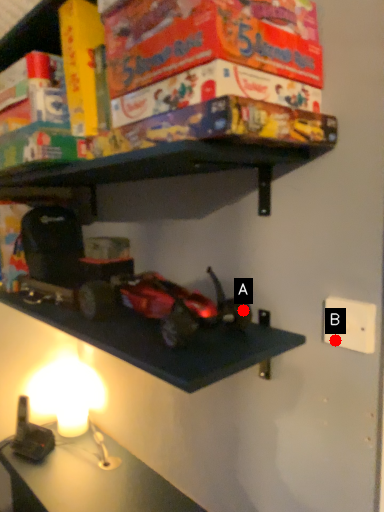
Question: Two points are circled on the image, labeled by A and B beside each circle. Among these points, which one is farthest from the camera?

Choices:
 (A) A is further
 (B) B is further

Answer: (A)